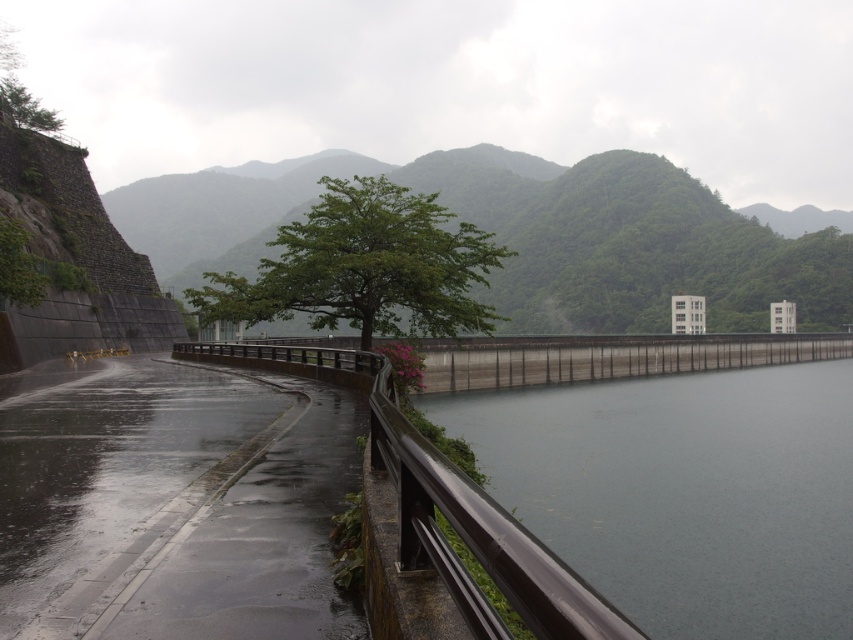
You are a hiker standing on the road and looking at the green leafy mountain at center and the green leafy tree at center. Which one is taller?

The green leafy mountain at center is much taller than the green leafy tree at center.

You are standing at the edge of the gray concrete dam at center and want to walk back to your car parked at the starting point, which is 20 meters away from the dam. Can you reach your car without needing to walk more than 20 meters?

The distance between the gray concrete dam at center and the camera is 17.06 meters. Since your car is parked 20 meters away from the dam, you can reach it by walking back towards the camera direction, as 17.06 meters is less than 20 meters.

You are standing at the viewpoint of the image and want to walk towards the point with coordinates point (634,550). Will you pass by point (659,300) before reaching your destination?

Since point (634,550) is in front of point (659,300), you will reach point (634,550) before passing point (659,300). Therefore, you will not pass by point (659,300) before reaching your destination.